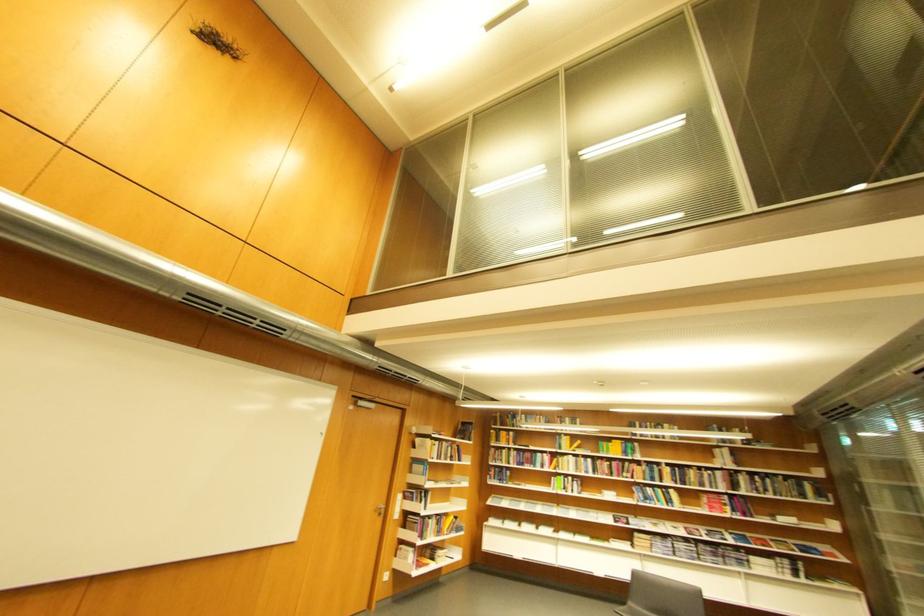
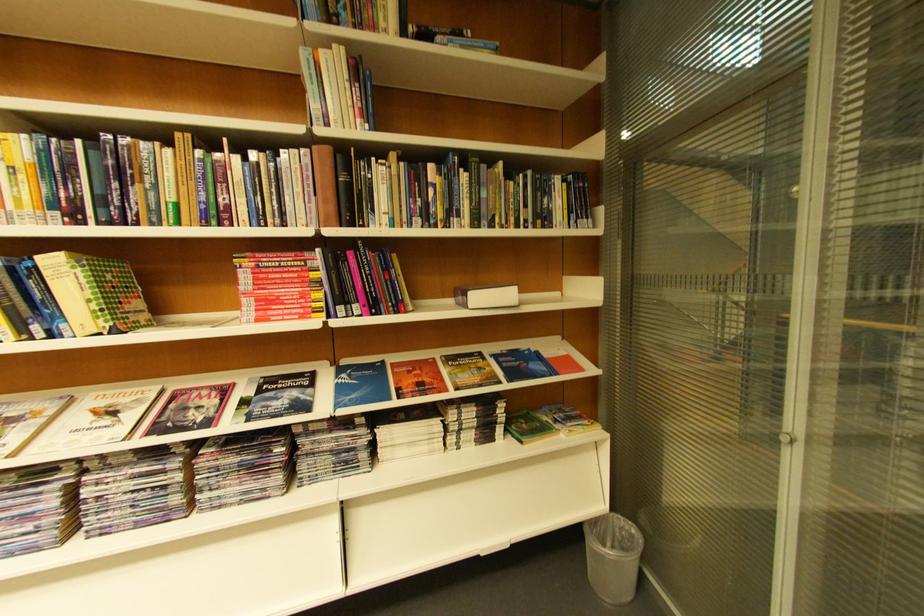
Find the pixel in the second image that matches pixel 722 498 in the first image.

(281, 262)